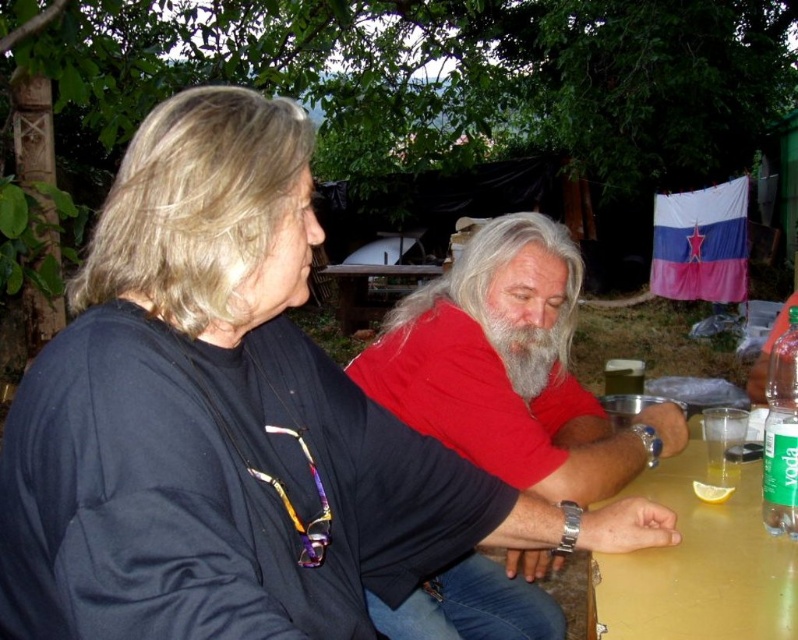
Is black matte shirt at upper left smaller than red matte shirt at center?

Correct, black matte shirt at upper left occupies less space than red matte shirt at center.

Who is more forward, (342, 573) or (524, 401)?

Point (342, 573) is more forward.

In order to click on black matte shirt at upper left in this screenshot , I will do pyautogui.click(x=243, y=432).

Is the position of black matte shirt at upper left more distant than that of yellow matte table at lower right?

No, black matte shirt at upper left is closer to the viewer.

Is the position of black matte shirt at upper left less distant than that of yellow matte table at lower right?

Yes, black matte shirt at upper left is in front of yellow matte table at lower right.

Where is `black matte shirt at upper left`? The width and height of the screenshot is (798, 640). black matte shirt at upper left is located at coordinates (243, 432).

Is black matte shirt at upper left above green plastic bottle at right?

No, black matte shirt at upper left is not above green plastic bottle at right.

Which is in front, point (468, 490) or point (785, 432)?

Point (785, 432) is more forward.

Where is `black matte shirt at upper left`? black matte shirt at upper left is located at coordinates (243, 432).